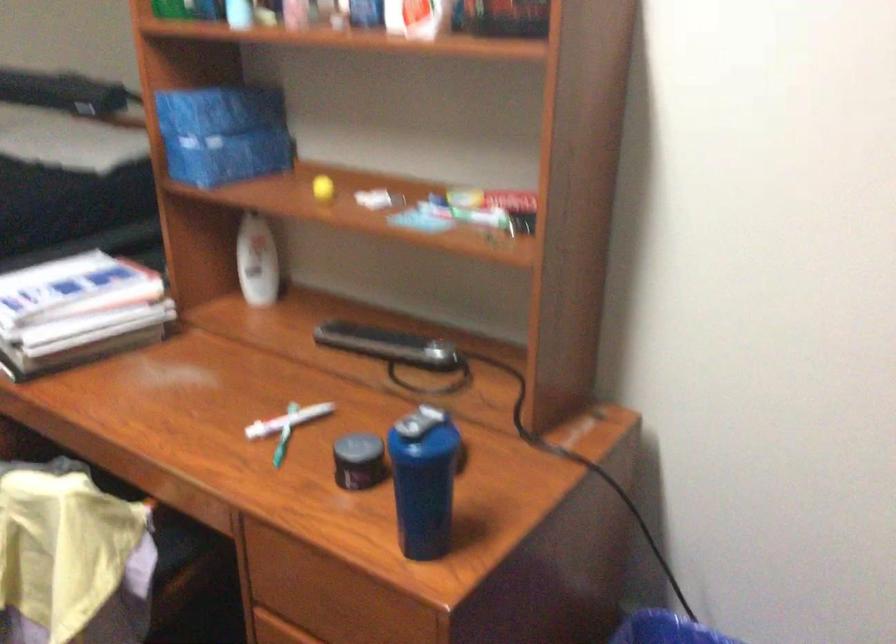
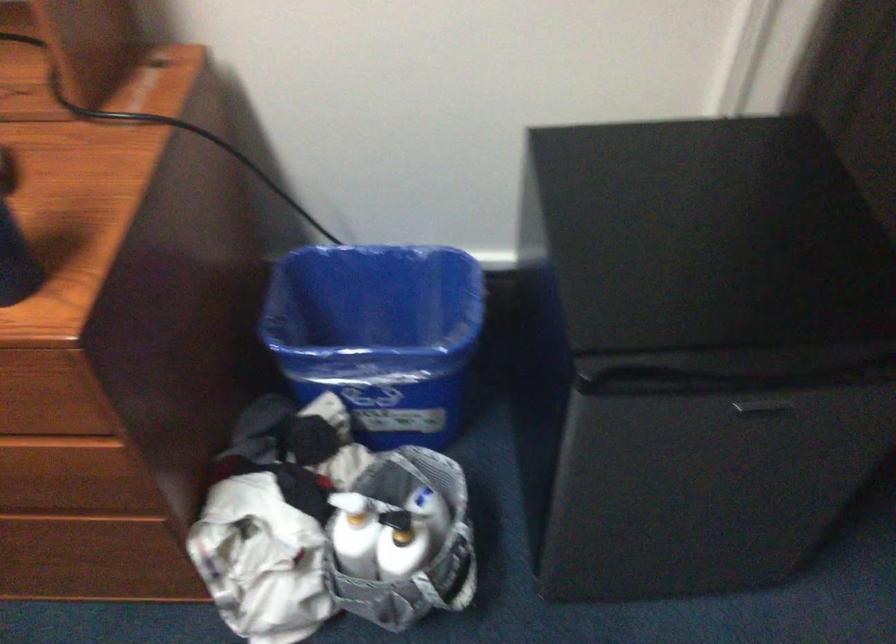
The images are taken continuously from a first-person perspective. In which direction is your viewpoint rotating?

The camera rotated toward right-down.